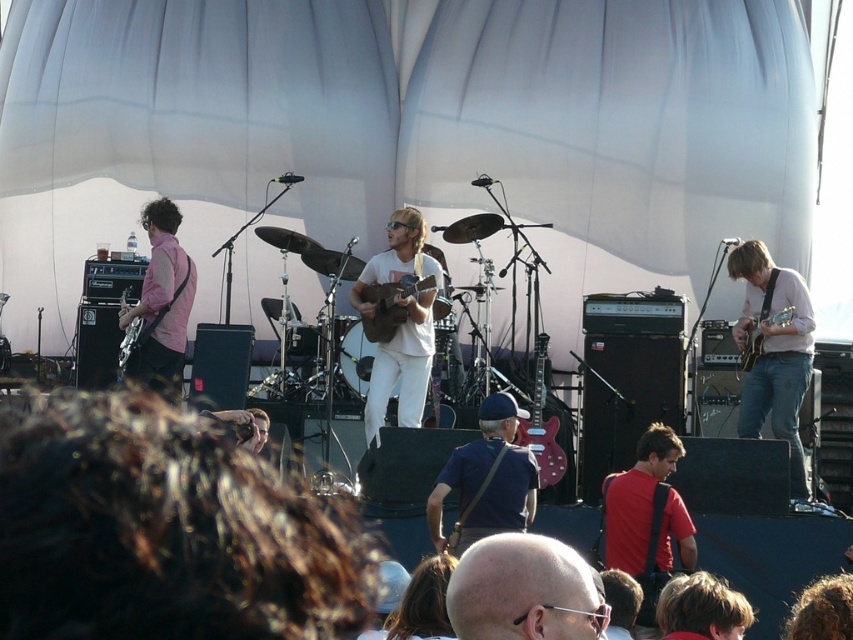
You are a photographer trying to capture a closeup of the guitarist in the center. The red matte shirt at center and the glossy wood guitar at center are both in your frame. Which object takes up more space in the photo?

The red matte shirt at center takes up more space in the photo because its width is larger than that of the glossy wood guitar at center.

You are a stagehand who needs to retrieve a dark blue fabric bag at center during a live performance. The stage is crowded with musicians. Which musician should you approach to avoid blocking the audience view, considering the bag is at point 0.748, 0.571?

The dark blue fabric bag at center is located at point (486,477). To avoid blocking the audience view, you should approach the musician in the center, as they are closest to the bag and positioned centrally on stage, minimizing obstruction.

You are a photographer at the outdoor concert venue and want to capture a closeup of the pink matte shirt at left without the dark blue fabric bag at center appearing in the foreground. Is the bag too tall to block the view?

The dark blue fabric bag at center has a lesser height compared to pink matte shirt at left, so it will not block the view. The photographer can capture the pink matte shirt at left without the bag obstructing the foreground.